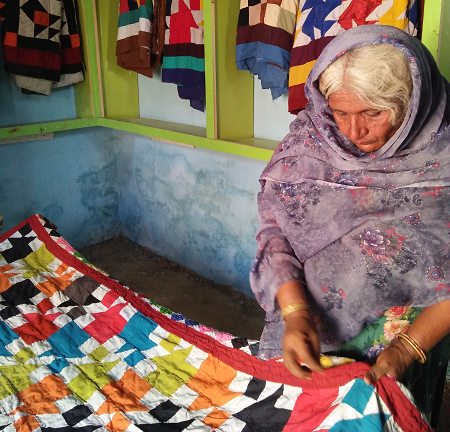
This screenshot has width=450, height=432. Find the location of `lime green shelf`. lime green shelf is located at coordinates (242, 147).